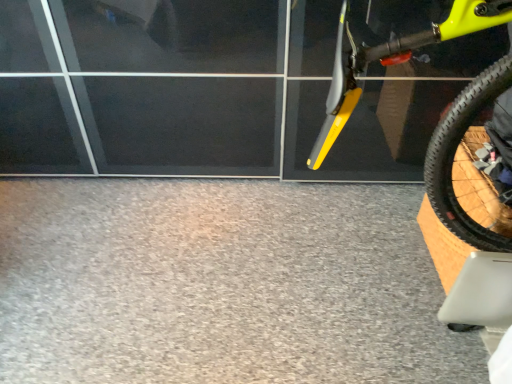
Question: Should I look upward or downward to see gray carpet at lower center?

Choices:
 (A) down
 (B) up

Answer: (A)

Question: From the image's perspective, is gray carpet at lower center above yellow matte bicycle at right?

Choices:
 (A) yes
 (B) no

Answer: (B)

Question: Is gray carpet at lower center far away from yellow matte bicycle at right?

Choices:
 (A) no
 (B) yes

Answer: (A)

Question: Does gray carpet at lower center have a lesser height compared to yellow matte bicycle at right?

Choices:
 (A) yes
 (B) no

Answer: (A)

Question: Is gray carpet at lower center surrounding yellow matte bicycle at right?

Choices:
 (A) yes
 (B) no

Answer: (B)

Question: Can you confirm if gray carpet at lower center is taller than yellow matte bicycle at right?

Choices:
 (A) yes
 (B) no

Answer: (B)

Question: Considering the relative positions of gray carpet at lower center and yellow matte bicycle at right in the image provided, is gray carpet at lower center behind yellow matte bicycle at right?

Choices:
 (A) yes
 (B) no

Answer: (A)

Question: Is yellow matte bicycle at right smaller than gray carpet at lower center?

Choices:
 (A) yes
 (B) no

Answer: (B)

Question: Is yellow matte bicycle at right shorter than gray carpet at lower center?

Choices:
 (A) yes
 (B) no

Answer: (B)

Question: Are yellow matte bicycle at right and gray carpet at lower center located far from each other?

Choices:
 (A) yes
 (B) no

Answer: (B)

Question: From a real-world perspective, is yellow matte bicycle at right below gray carpet at lower center?

Choices:
 (A) yes
 (B) no

Answer: (B)

Question: From the image's perspective, would you say yellow matte bicycle at right is shown under gray carpet at lower center?

Choices:
 (A) no
 (B) yes

Answer: (A)

Question: From a real-world perspective, is yellow matte bicycle at right on top of gray carpet at lower center?

Choices:
 (A) yes
 (B) no

Answer: (A)

Question: Does point (288, 228) appear closer or farther from the camera than point (350, 72)?

Choices:
 (A) farther
 (B) closer

Answer: (A)